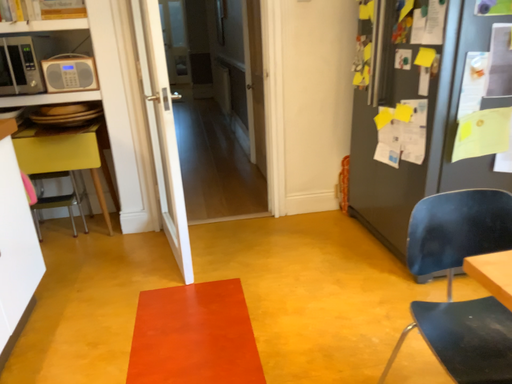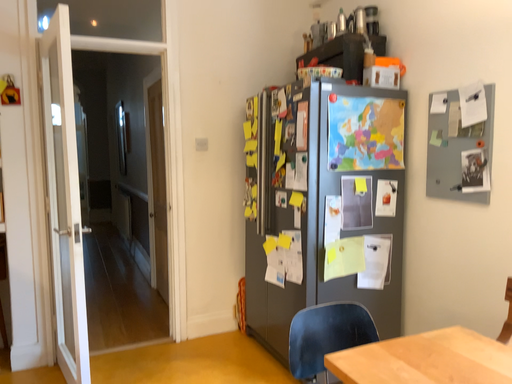
Question: Which way did the camera rotate in the video?

Choices:
 (A) rotated left
 (B) rotated right

Answer: (B)